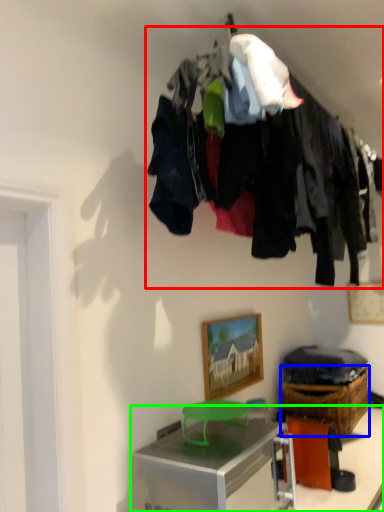
Question: Which is nearer to the closet (highlighted by a red box)? crate (highlighted by a blue box) or desk (highlighted by a green box).

Choices:
 (A) crate
 (B) desk

Answer: (B)